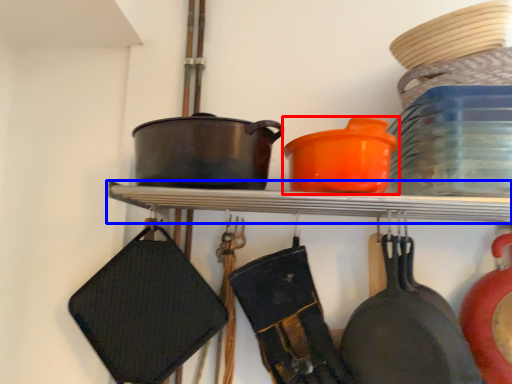
Question: Among these objects, which one is nearest to the camera, tableware (highlighted by a red box) or shelf (highlighted by a blue box)?

Choices:
 (A) tableware
 (B) shelf

Answer: (A)